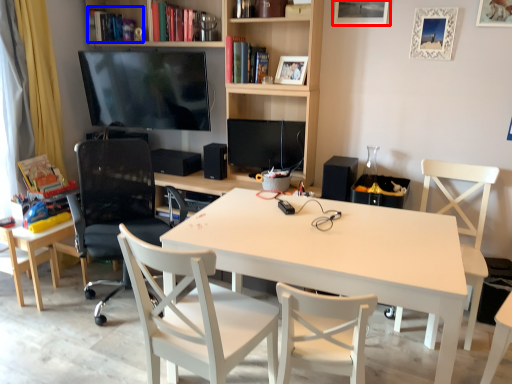
Question: Among these objects, which one is farthest to the camera, picture frame (highlighted by a red box) or book (highlighted by a blue box)?

Choices:
 (A) picture frame
 (B) book

Answer: (B)